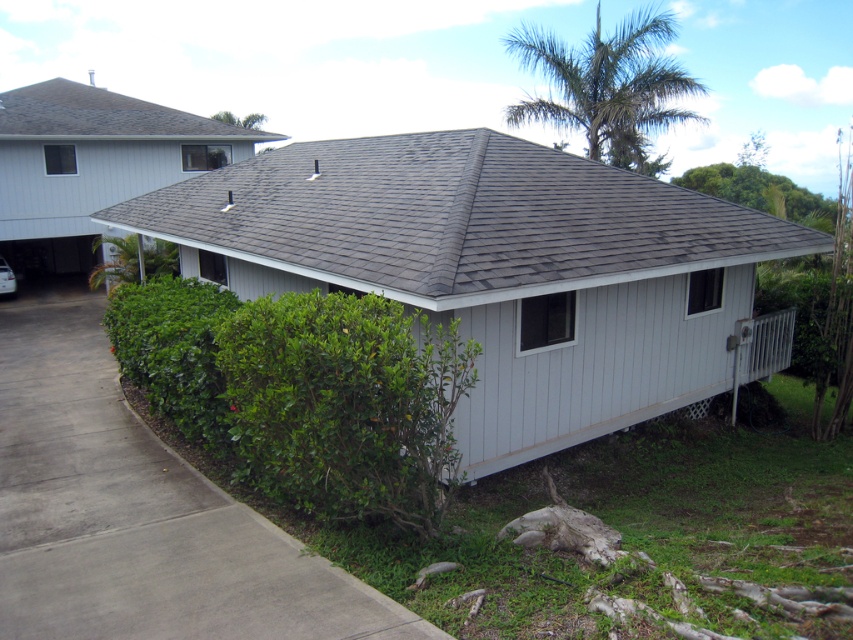
Who is more distant from viewer, (689, 244) or (80, 118)?

The point (80, 118) is behind.

Is gray shingles at center above gray shingles at upper left?

Incorrect, gray shingles at center is not positioned above gray shingles at upper left.

Does point (200, 179) lie in front of point (57, 97)?

Yes, point (200, 179) is in front of point (57, 97).

Identify the location of gray shingles at center. (456, 218).

Is gray concrete driveway at lower left bigger than gray shingles at upper left?

Actually, gray concrete driveway at lower left might be smaller than gray shingles at upper left.

You are a GUI agent. You are given a task and a screenshot of the screen. Output one action in this format:
    pyautogui.click(x=<x>, y=<y>)
    Task: Click on the gray concrete driveway at lower left
    The image size is (853, 640).
    Given the screenshot: What is the action you would take?
    pyautogui.click(x=138, y=515)

Is gray shingles at center taller than gray concrete driveway at lower left?

Yes.

Which is below, gray shingles at center or gray concrete driveway at lower left?

Positioned lower is gray concrete driveway at lower left.

Is point (456, 182) closer to viewer compared to point (181, 531)?

No, it is behind (181, 531).

Locate an element on the screen. gray shingles at center is located at coordinates (456, 218).